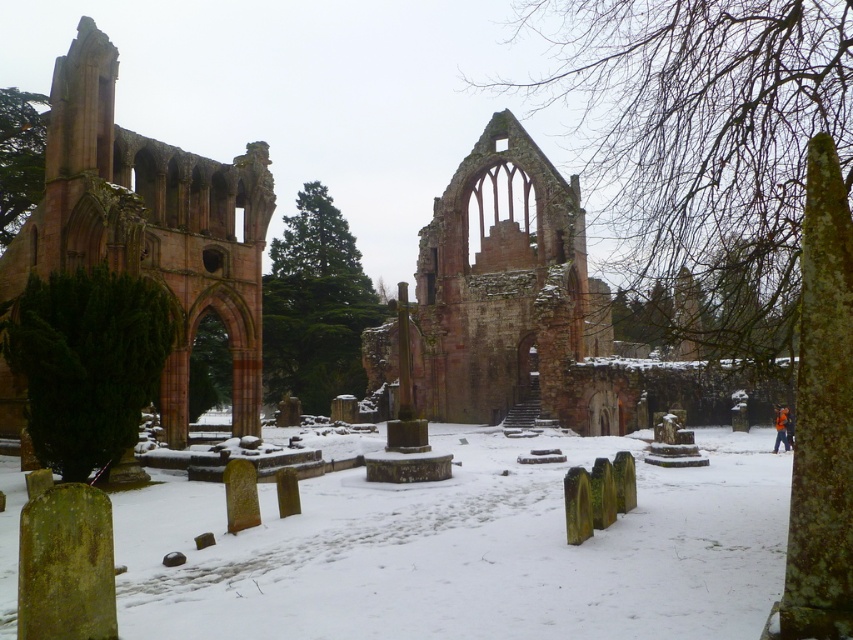
You are an architect examining the ruins and want to compare the structures. Which one is shorter between the rustic stone arch at left and the rustic stone ruins at center?

The rustic stone arch at left is shorter than the rustic stone ruins at center.

You are an archaeologist examining the ruins. You need to determine which structure is wider between the rustic stone arch at left and the rustic stone ruins at center. Based on the scene, which one is wider?

The rustic stone ruins at center are wider than the rustic stone arch at left.

Consider the image. You are standing in the snowy graveyard near the old abbey ruins. You need to walk from the gravestones in the foreground to the entrance of the structure. Which object, the rustic stone arch at left or the rustic stone ruins at center, should you approach first to reach the entrance?

The rustic stone arch at left is located above the rustic stone ruins at center, so you should approach the rustic stone ruins at center first before reaching the entrance under the rustic stone arch at left.